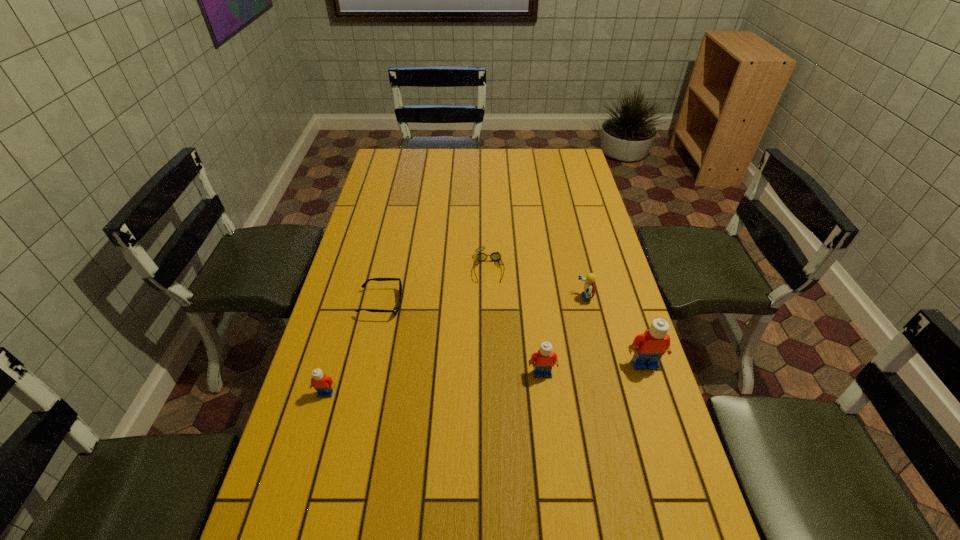
Locate which Lego ranks third in proximity to the fifth object from left to right. Please provide its 2D coordinates. Your answer should be formatted as a tuple, i.e. [(x, y)], where the tuple contains the x and y coordinates of a point satisfying the conditions above.

[(323, 384)]

You are a GUI agent. You are given a task and a screenshot of the screen. Output one action in this format:
    pyautogui.click(x=<x>, y=<y>)
    Task: Click on the vacant space that satisfies the following two spatial constraints: 1. on the front-facing side of the farthest object; 2. on the front-facing side of the sunglasses
    This screenshot has width=960, height=540.
    Given the screenshot: What is the action you would take?
    pyautogui.click(x=490, y=303)

Where is `vacant position in the image that satisfies the following two spatial constraints: 1. on the front-facing side of the third Lego from left to right; 2. on the face of the nearest object`? Image resolution: width=960 pixels, height=540 pixels. vacant position in the image that satisfies the following two spatial constraints: 1. on the front-facing side of the third Lego from left to right; 2. on the face of the nearest object is located at coordinates (607, 393).

Identify the location of free space that satisfies the following two spatial constraints: 1. on the front-facing side of the farthest object; 2. on the front-facing side of the sunglasses. The width and height of the screenshot is (960, 540). (490, 303).

The height and width of the screenshot is (540, 960). What are the coordinates of `vacant position in the image that satisfies the following two spatial constraints: 1. on the front-facing side of the farthest Lego; 2. on the face of the third Lego from right to left` in the screenshot? It's located at (602, 373).